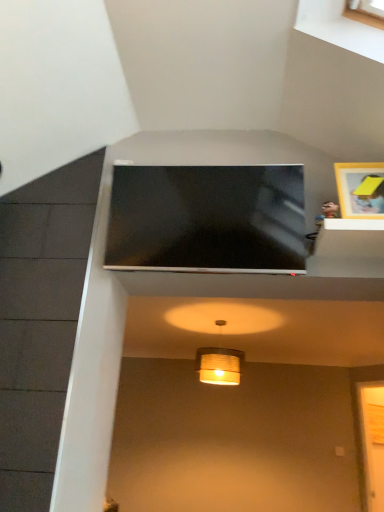
Question: Is matte yellow paper lampshade at center with wooden picture frame at upper right?

Choices:
 (A) no
 (B) yes

Answer: (A)

Question: From a real-world perspective, is matte yellow paper lampshade at center positioned under wooden picture frame at upper right based on gravity?

Choices:
 (A) no
 (B) yes

Answer: (B)

Question: From a real-world perspective, is matte yellow paper lampshade at center over wooden picture frame at upper right?

Choices:
 (A) yes
 (B) no

Answer: (B)

Question: Does matte yellow paper lampshade at center have a lesser height compared to wooden picture frame at upper right?

Choices:
 (A) yes
 (B) no

Answer: (B)

Question: Considering the relative sizes of matte yellow paper lampshade at center and wooden picture frame at upper right in the image provided, is matte yellow paper lampshade at center thinner than wooden picture frame at upper right?

Choices:
 (A) no
 (B) yes

Answer: (A)

Question: Considering the relative positions of matte yellow paper lampshade at center and wooden picture frame at upper right in the image provided, is matte yellow paper lampshade at center to the right of wooden picture frame at upper right from the viewer's perspective?

Choices:
 (A) yes
 (B) no

Answer: (B)

Question: Considering the relative sizes of wooden picture frame at upper right and matte black tv at upper center in the image provided, is wooden picture frame at upper right wider than matte black tv at upper center?

Choices:
 (A) no
 (B) yes

Answer: (A)

Question: Can you confirm if wooden picture frame at upper right is smaller than matte black tv at upper center?

Choices:
 (A) no
 (B) yes

Answer: (B)

Question: Is wooden picture frame at upper right far away from matte black tv at upper center?

Choices:
 (A) no
 (B) yes

Answer: (A)

Question: Is wooden picture frame at upper right positioned with its back to matte black tv at upper center?

Choices:
 (A) no
 (B) yes

Answer: (A)

Question: Is wooden picture frame at upper right beside matte black tv at upper center?

Choices:
 (A) yes
 (B) no

Answer: (B)

Question: Can you confirm if wooden picture frame at upper right is positioned to the left of matte black tv at upper center?

Choices:
 (A) no
 (B) yes

Answer: (A)

Question: Is matte yellow paper lampshade at center bigger than matte black tv at upper center?

Choices:
 (A) no
 (B) yes

Answer: (A)